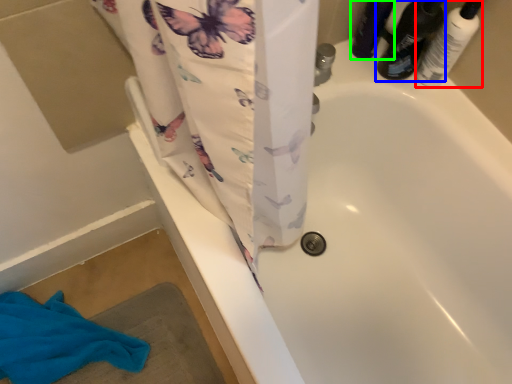
Question: Which object is positioned closest to toiletry (highlighted by a red box)? Select from footwear (highlighted by a blue box) and toiletry (highlighted by a green box).

Choices:
 (A) footwear
 (B) toiletry

Answer: (A)